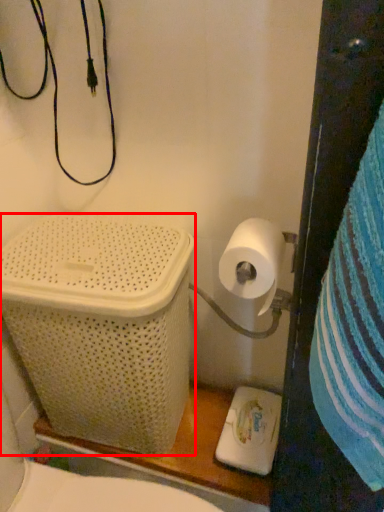
Question: From the image's perspective, where is laundry basket (annotated by the red box) located in relation to toilet paper in the image?

Choices:
 (A) below
 (B) above

Answer: (A)